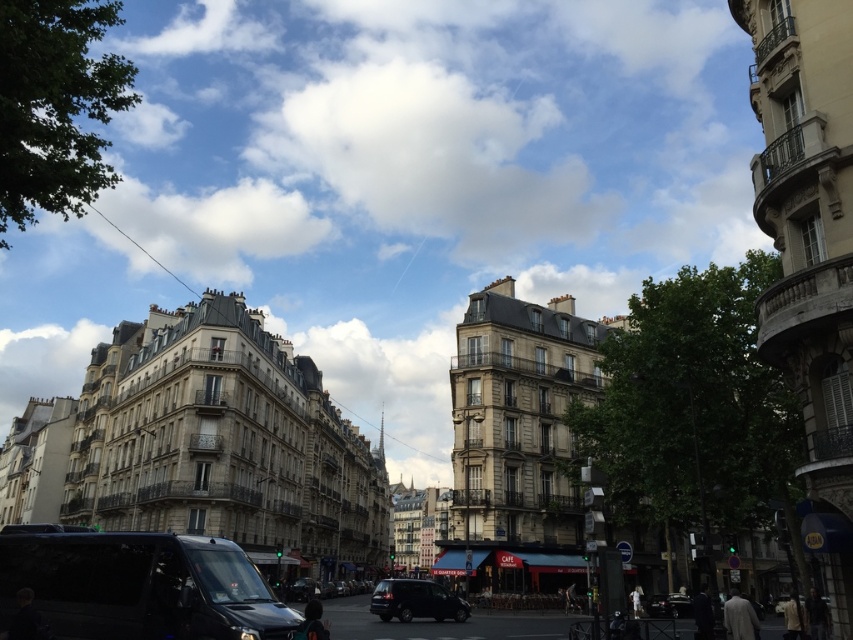
Can you confirm if shiny black van at lower left is taller than shiny black suv at center?

No.

Describe the element at coordinates (140, 586) in the screenshot. I see `shiny black van at lower left` at that location.

Between point (242, 612) and point (376, 602), which one is positioned behind?

The point (376, 602) is more distant.

Locate an element on the screen. shiny black van at lower left is located at coordinates (140, 586).

Can you confirm if white fluffy cloud at upper center is thinner than shiny black car at lower right?

No, white fluffy cloud at upper center is not thinner than shiny black car at lower right.

What do you see at coordinates (430, 156) in the screenshot? The width and height of the screenshot is (853, 640). I see `white fluffy cloud at upper center` at bounding box center [430, 156].

What are the coordinates of `white fluffy cloud at upper center` in the screenshot? It's located at (430, 156).

Where is `white fluffy cloud at upper center`? This screenshot has width=853, height=640. white fluffy cloud at upper center is located at coordinates (430, 156).

Is shiny black van at lower left to the left of shiny black car at lower right from the viewer's perspective?

Indeed, shiny black van at lower left is positioned on the left side of shiny black car at lower right.

Describe the element at coordinates (140, 586) in the screenshot. I see `shiny black van at lower left` at that location.

Where is `shiny black van at lower left`? This screenshot has width=853, height=640. shiny black van at lower left is located at coordinates (140, 586).